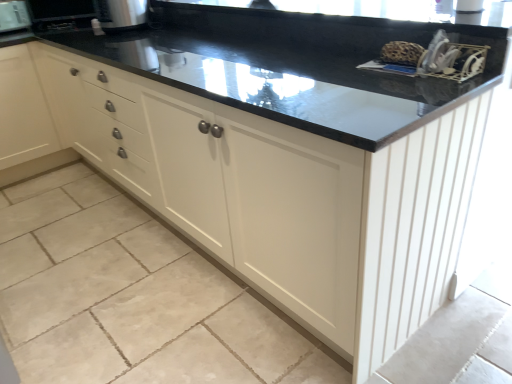
Image resolution: width=512 pixels, height=384 pixels. In order to click on satin silver toaster at upper left, marked as the first appliance in a front-to-back arrangement in this screenshot , I will do click(x=120, y=14).

Describe the element at coordinates (120, 14) in the screenshot. I see `satin silver toaster at upper left, which is the 2th appliance from left to right` at that location.

How much space does satin silver toaster at upper left, which is the 2th appliance from left to right, occupy horizontally?

It is 11.83 inches.

The image size is (512, 384). Identify the location of brushed metal toaster at upper left, which appears as the second appliance when viewed from the front. (13, 15).

What do you see at coordinates (13, 15) in the screenshot?
I see `brushed metal toaster at upper left, acting as the 1th appliance starting from the left` at bounding box center [13, 15].

You are a GUI agent. You are given a task and a screenshot of the screen. Output one action in this format:
    pyautogui.click(x=<x>, y=<y>)
    Task: Click on the satin silver toaster at upper left, marked as the first appliance in a front-to-back arrangement
    The width and height of the screenshot is (512, 384).
    Given the screenshot: What is the action you would take?
    pyautogui.click(x=120, y=14)

Is satin silver toaster at upper left, arranged as the 1th appliance when viewed from the right, at the left side of brushed metal toaster at upper left, the 2th appliance when ordered from right to left?

Incorrect, satin silver toaster at upper left, arranged as the 1th appliance when viewed from the right, is not on the left side of brushed metal toaster at upper left, the 2th appliance when ordered from right to left.

Relative to brushed metal toaster at upper left, acting as the 1th appliance starting from the left, is satin silver toaster at upper left, which is the 2th appliance from left to right, in front or behind?

In the image, satin silver toaster at upper left, which is the 2th appliance from left to right, appears in front of brushed metal toaster at upper left, acting as the 1th appliance starting from the left.

Which is behind, point (103, 28) or point (10, 5)?

Positioned behind is point (10, 5).

From the image's perspective, is satin silver toaster at upper left, marked as the first appliance in a front-to-back arrangement, located above or below brushed metal toaster at upper left, acting as the 1th appliance starting from the left?

Based on their image positions, satin silver toaster at upper left, marked as the first appliance in a front-to-back arrangement, is located beneath brushed metal toaster at upper left, acting as the 1th appliance starting from the left.

Consider the image. From a real-world perspective, which is physically above, satin silver toaster at upper left, arranged as the 1th appliance when viewed from the right, or brushed metal toaster at upper left, acting as the 1th appliance starting from the left?

satin silver toaster at upper left, arranged as the 1th appliance when viewed from the right, from a real-world perspective.

Which of these two, satin silver toaster at upper left, arranged as the 1th appliance when viewed from the right, or brushed metal toaster at upper left, which appears as the second appliance when viewed from the front, is wider?

Wider between the two is satin silver toaster at upper left, arranged as the 1th appliance when viewed from the right.

Is satin silver toaster at upper left, which is the 2th appliance from left to right, taller than brushed metal toaster at upper left, the 1th appliance positioned from the back?

Incorrect, the height of satin silver toaster at upper left, which is the 2th appliance from left to right, is not larger of that of brushed metal toaster at upper left, the 1th appliance positioned from the back.

Can you confirm if satin silver toaster at upper left, arranged as the 1th appliance when viewed from the right, is bigger than brushed metal toaster at upper left, the 2th appliance when ordered from right to left?

Correct, satin silver toaster at upper left, arranged as the 1th appliance when viewed from the right, is larger in size than brushed metal toaster at upper left, the 2th appliance when ordered from right to left.

Would you say satin silver toaster at upper left, marked as the first appliance in a front-to-back arrangement, is outside brushed metal toaster at upper left, which appears as the second appliance when viewed from the front?

Indeed, satin silver toaster at upper left, marked as the first appliance in a front-to-back arrangement, is completely outside brushed metal toaster at upper left, which appears as the second appliance when viewed from the front.

Would you consider satin silver toaster at upper left, arranged as the 1th appliance when viewed from the right, to be distant from brushed metal toaster at upper left, which appears as the second appliance when viewed from the front?

satin silver toaster at upper left, arranged as the 1th appliance when viewed from the right, is near brushed metal toaster at upper left, which appears as the second appliance when viewed from the front, not far away.

Does satin silver toaster at upper left, marked as the first appliance in a front-to-back arrangement, turn towards brushed metal toaster at upper left, which appears as the second appliance when viewed from the front?

No, satin silver toaster at upper left, marked as the first appliance in a front-to-back arrangement, is not aimed at brushed metal toaster at upper left, which appears as the second appliance when viewed from the front.

Measure the distance between satin silver toaster at upper left, arranged as the 1th appliance when viewed from the right, and brushed metal toaster at upper left, the 2th appliance when ordered from right to left.

satin silver toaster at upper left, arranged as the 1th appliance when viewed from the right, and brushed metal toaster at upper left, the 2th appliance when ordered from right to left, are 33.91 inches apart.

At what (x,y) coordinates should I click in order to perform the action: click on appliance in front of the brushed metal toaster at upper left, acting as the 1th appliance starting from the left. Please return your answer as a coordinate pair (x, y). The height and width of the screenshot is (384, 512). Looking at the image, I should click on (120, 14).

Which is more to the left, brushed metal toaster at upper left, which appears as the second appliance when viewed from the front, or satin silver toaster at upper left, marked as the first appliance in a front-to-back arrangement?

Positioned to the left is brushed metal toaster at upper left, which appears as the second appliance when viewed from the front.

Does brushed metal toaster at upper left, the 2th appliance when ordered from right to left, come in front of satin silver toaster at upper left, which is the 2th appliance from left to right?

No, brushed metal toaster at upper left, the 2th appliance when ordered from right to left, is further to the viewer.

Which is in front, point (0, 32) or point (115, 8)?

The point (115, 8) is in front.

In the scene shown: From the image's perspective, does brushed metal toaster at upper left, which appears as the second appliance when viewed from the front, appear higher than satin silver toaster at upper left, which is the 2th appliance from left to right?

Yes, from the image's perspective, brushed metal toaster at upper left, which appears as the second appliance when viewed from the front, is above satin silver toaster at upper left, which is the 2th appliance from left to right.

From a real-world perspective, who is located lower, brushed metal toaster at upper left, the 2th appliance when ordered from right to left, or satin silver toaster at upper left, which is the 2th appliance from left to right?

brushed metal toaster at upper left, the 2th appliance when ordered from right to left, is physically lower.

Between brushed metal toaster at upper left, acting as the 1th appliance starting from the left, and satin silver toaster at upper left, arranged as the 1th appliance when viewed from the right, which one has smaller width?

brushed metal toaster at upper left, acting as the 1th appliance starting from the left, is thinner.

Between brushed metal toaster at upper left, the 2th appliance when ordered from right to left, and satin silver toaster at upper left, marked as the first appliance in a front-to-back arrangement, which one has more height?

With more height is brushed metal toaster at upper left, the 2th appliance when ordered from right to left.

From the picture: Between brushed metal toaster at upper left, which appears as the second appliance when viewed from the front, and satin silver toaster at upper left, arranged as the 1th appliance when viewed from the right, which one has smaller size?

With smaller size is brushed metal toaster at upper left, which appears as the second appliance when viewed from the front.

Is satin silver toaster at upper left, arranged as the 1th appliance when viewed from the right, completely or partially inside brushed metal toaster at upper left, the 2th appliance when ordered from right to left?

That's incorrect, satin silver toaster at upper left, arranged as the 1th appliance when viewed from the right, is not inside brushed metal toaster at upper left, the 2th appliance when ordered from right to left.

Is brushed metal toaster at upper left, which appears as the second appliance when viewed from the front, placed right next to satin silver toaster at upper left, the second appliance from the back?

No, brushed metal toaster at upper left, which appears as the second appliance when viewed from the front, is not making contact with satin silver toaster at upper left, the second appliance from the back.

Is brushed metal toaster at upper left, which appears as the second appliance when viewed from the front, facing towards satin silver toaster at upper left, marked as the first appliance in a front-to-back arrangement?

Yes, brushed metal toaster at upper left, which appears as the second appliance when viewed from the front, is oriented towards satin silver toaster at upper left, marked as the first appliance in a front-to-back arrangement.

Can you tell me how much brushed metal toaster at upper left, the 1th appliance positioned from the back, and satin silver toaster at upper left, arranged as the 1th appliance when viewed from the right, differ in facing direction?

There is a 85.9-degree angle between the facing directions of brushed metal toaster at upper left, the 1th appliance positioned from the back, and satin silver toaster at upper left, arranged as the 1th appliance when viewed from the right.

Locate an element on the screen. The image size is (512, 384). appliance beneath the satin silver toaster at upper left, arranged as the 1th appliance when viewed from the right (from a real-world perspective) is located at coordinates (13, 15).

Identify the location of appliance above the satin silver toaster at upper left, which is the 2th appliance from left to right (from the image's perspective). (13, 15).

The width and height of the screenshot is (512, 384). Find the location of `appliance that is behind the satin silver toaster at upper left, which is the 2th appliance from left to right`. appliance that is behind the satin silver toaster at upper left, which is the 2th appliance from left to right is located at coordinates (13, 15).